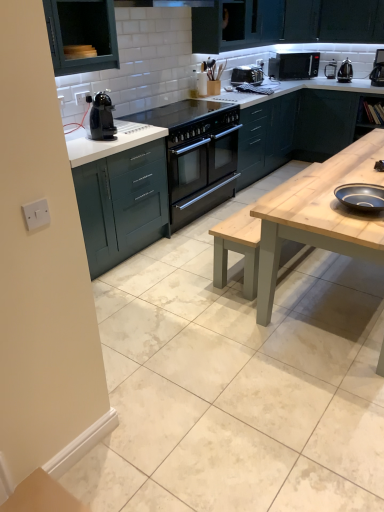
Question: Considering the relative sizes of black metallic kettle at upper right, which is the 3th appliance in front-to-back order, and teal wood cabinet at upper left, arranged as the 1th cabinetry when viewed from the left, in the image provided, is black metallic kettle at upper right, which is the 3th appliance in front-to-back order, taller than teal wood cabinet at upper left, arranged as the 1th cabinetry when viewed from the left,?

Choices:
 (A) no
 (B) yes

Answer: (A)

Question: Does black metallic kettle at upper right, the 1th appliance when ordered from back to front, lie in front of teal wood cabinet at upper left, arranged as the 1th cabinetry when viewed from the left?

Choices:
 (A) yes
 (B) no

Answer: (B)

Question: Is black metallic kettle at upper right, the first appliance viewed from the top, not close to teal wood cabinet at upper left, which is the 4th cabinetry in right-to-left order?

Choices:
 (A) no
 (B) yes

Answer: (B)

Question: Does black metallic kettle at upper right, the 1th appliance when ordered from back to front, have a greater width compared to teal wood cabinet at upper left, arranged as the 1th cabinetry when viewed from the left?

Choices:
 (A) no
 (B) yes

Answer: (A)

Question: From the image's perspective, is black metallic kettle at upper right, which is the 3th appliance in front-to-back order, under teal wood cabinet at upper left, which is the 4th cabinetry in right-to-left order?

Choices:
 (A) no
 (B) yes

Answer: (A)

Question: Do you think black plastic coffee machine at upper right is within black plastic toaster at center, the first appliance in the left-to-right sequence, or outside of it?

Choices:
 (A) outside
 (B) inside

Answer: (A)

Question: In terms of height, does black plastic coffee machine at upper right look taller or shorter compared to black plastic toaster at center, the first appliance in the left-to-right sequence?

Choices:
 (A) short
 (B) tall

Answer: (B)

Question: Visually, is black plastic coffee machine at upper right positioned to the left or to the right of black plastic toaster at center, positioned as the 2th appliance in back-to-front order?

Choices:
 (A) left
 (B) right

Answer: (B)

Question: Considering the positions of black plastic coffee machine at upper right and black plastic toaster at center, the 2th appliance positioned from the top, in the image, is black plastic coffee machine at upper right wider or thinner than black plastic toaster at center, the 2th appliance positioned from the top,?

Choices:
 (A) wide
 (B) thin

Answer: (B)

Question: In terms of size, does black plastic toaster at center, the 2th appliance positioned from the top, appear bigger or smaller than black plastic coffee machine at upper right?

Choices:
 (A) small
 (B) big

Answer: (B)

Question: Considering the positions of point (261, 72) and point (375, 82), is point (261, 72) closer or farther from the camera than point (375, 82)?

Choices:
 (A) farther
 (B) closer

Answer: (A)

Question: Would you say black plastic toaster at center, which appears as the 3th appliance when viewed from the right, is inside or outside black plastic coffee machine at upper right?

Choices:
 (A) inside
 (B) outside

Answer: (B)

Question: Considering the positions of black plastic toaster at center, the 2th appliance viewed from the front, and black plastic coffee machine at upper right in the image, is black plastic toaster at center, the 2th appliance viewed from the front, taller or shorter than black plastic coffee machine at upper right?

Choices:
 (A) short
 (B) tall

Answer: (A)

Question: From a real-world perspective, is black glass cooktop at center above or below black matte microwave at upper right?

Choices:
 (A) above
 (B) below

Answer: (B)

Question: Looking at the image, does black glass cooktop at center seem bigger or smaller compared to black matte microwave at upper right?

Choices:
 (A) small
 (B) big

Answer: (B)